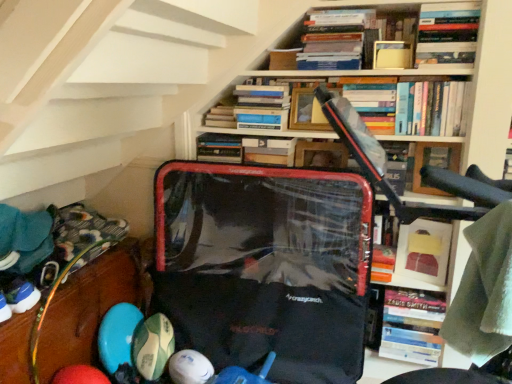
Question: Looking at the image, does matte yellow book at upper center, which is the third book from top to bottom, seem bigger or smaller compared to hardcover book at upper right, arranged as the 2th book when viewed from the top?

Choices:
 (A) small
 (B) big

Answer: (A)

Question: Considering the relative positions of matte yellow book at upper center, which is the third book from top to bottom, and hardcover book at upper right, arranged as the 2th book when viewed from the top, in the image provided, is matte yellow book at upper center, which is the third book from top to bottom, to the left or to the right of hardcover book at upper right, arranged as the 2th book when viewed from the top,?

Choices:
 (A) right
 (B) left

Answer: (B)

Question: Estimate the real-world distances between objects in this image. Which object is farther from the matte black suitcase at center?

Choices:
 (A) white rubber ball at lower center, which is the second toy in left-to-right order
 (B) hardcover book at upper center, the 4th book in the top-to-bottom sequence
 (C) hardcover book at center, which is the 1th book from bottom to top
 (D) wooden frame at upper center, the first shelf when ordered from top to bottom
 (E) hardcover book at upper center, the 1th book when ordered from top to bottom

Answer: (A)

Question: Considering the real-world distances, which object is farthest from the rubberized plastic balls at lower left, which ranks as the 1th shelf in left-to-right order?

Choices:
 (A) matte black suitcase at center
 (B) black plastic bag at center
 (C) green fabric at upper right
 (D) hardcover book at center, which is the 1th book from bottom to top
 (E) hardcover book at upper center, the 1th book when ordered from top to bottom

Answer: (C)